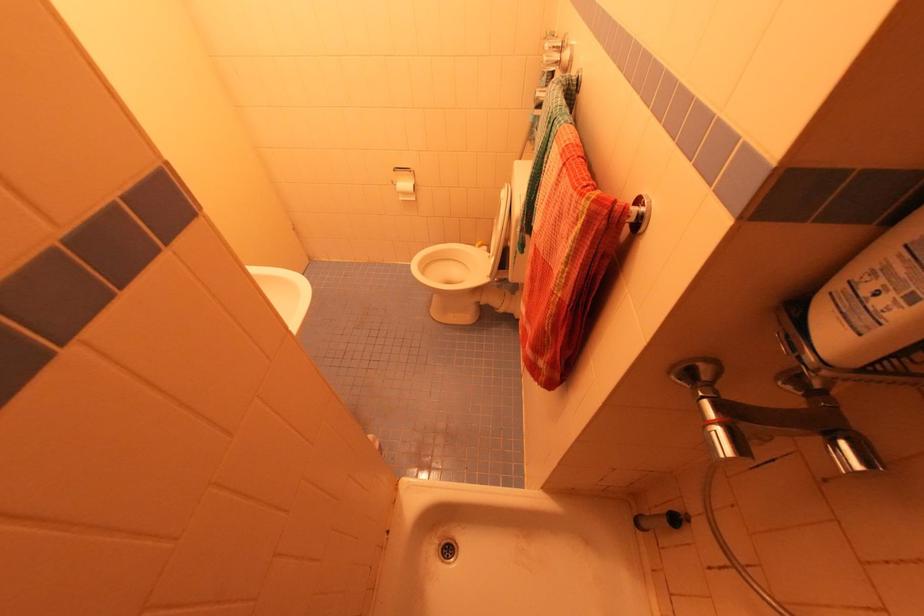
Find where to squeez the white shampoo bottle. Please return your answer as a coordinate pair (x, y).

(871, 301)